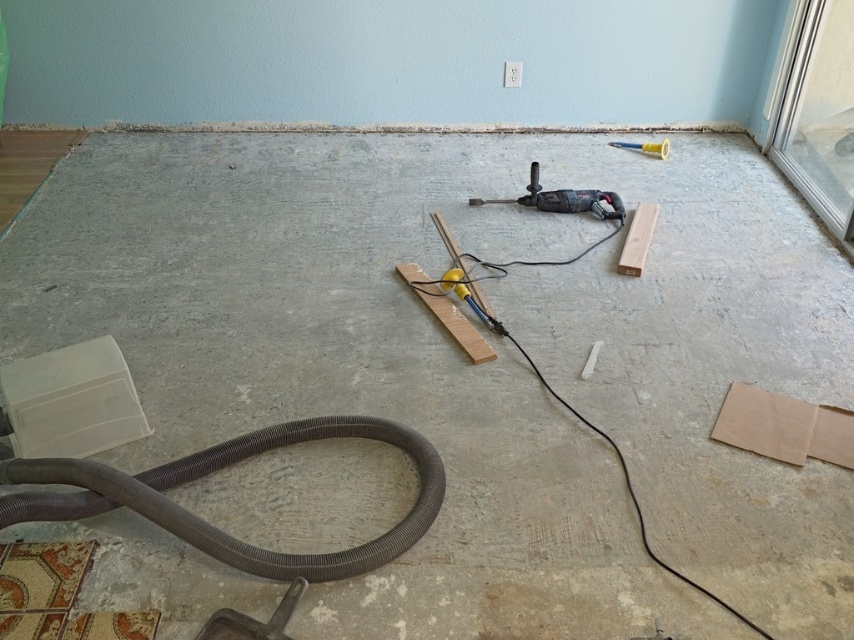
You are a construction worker needing to reach both the gray rubber hose at lower left and the yellow plastic hammer at upper right. Which object will you need to walk further to retrieve?

The yellow plastic hammer at upper right is further away from the viewer compared to the gray rubber hose at lower left, so you will need to walk further to retrieve the yellow plastic hammer at upper right.